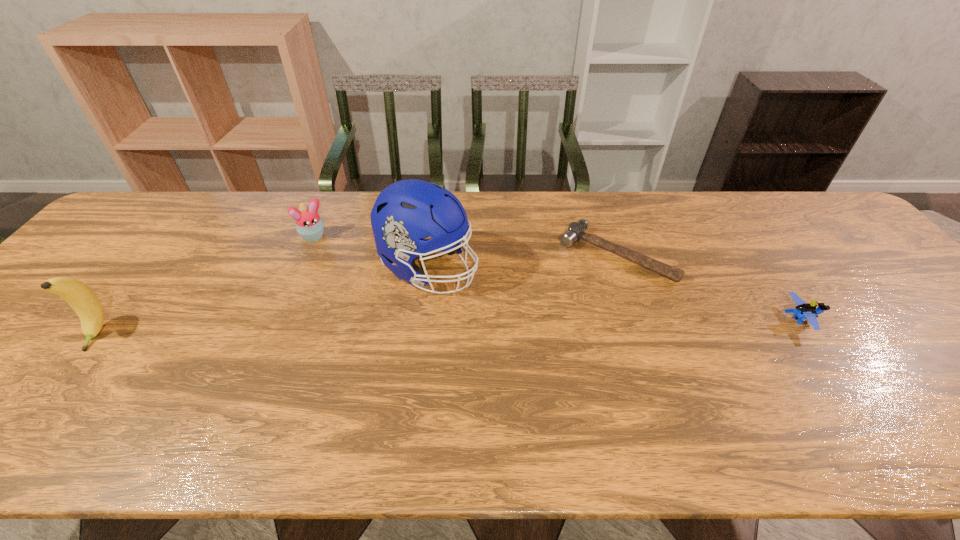
Where is `vacant space positioned on the face of the fourth object from right to left`? The height and width of the screenshot is (540, 960). vacant space positioned on the face of the fourth object from right to left is located at coordinates (342, 276).

This screenshot has height=540, width=960. Identify the location of hammer present at the far edge. (576, 231).

The image size is (960, 540). What are the coordinates of `cupcake that is at the far edge` in the screenshot? It's located at (309, 225).

You are a GUI agent. You are given a task and a screenshot of the screen. Output one action in this format:
    pyautogui.click(x=<x>, y=<y>)
    Task: Click on the free space at the far edge of the desktop
    Image resolution: width=960 pixels, height=540 pixels.
    Given the screenshot: What is the action you would take?
    pyautogui.click(x=591, y=210)

Image resolution: width=960 pixels, height=540 pixels. In order to click on free spot at the near edge of the desktop in this screenshot , I will do `click(491, 407)`.

In the image, there is a desktop. Where is `vacant space at the left edge`? Image resolution: width=960 pixels, height=540 pixels. vacant space at the left edge is located at coordinates (98, 281).

Find the location of a particular element. The width and height of the screenshot is (960, 540). free space at the right edge of the desktop is located at coordinates (866, 299).

The width and height of the screenshot is (960, 540). Find the location of `vacant region at the far left corner`. vacant region at the far left corner is located at coordinates (154, 195).

The image size is (960, 540). In the image, there is a desktop. In order to click on vacant space at the far right corner in this screenshot , I will do `click(822, 207)`.

Identify the location of free spot between the Lego and the second object from left to right. This screenshot has height=540, width=960. (557, 278).